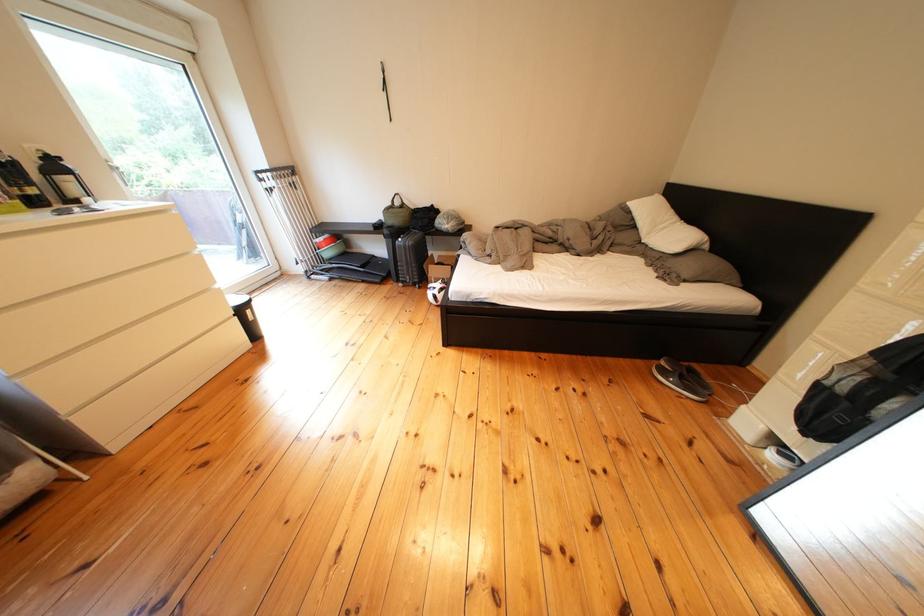
Describe the element at coordinates (860, 391) in the screenshot. I see `the green bag handle` at that location.